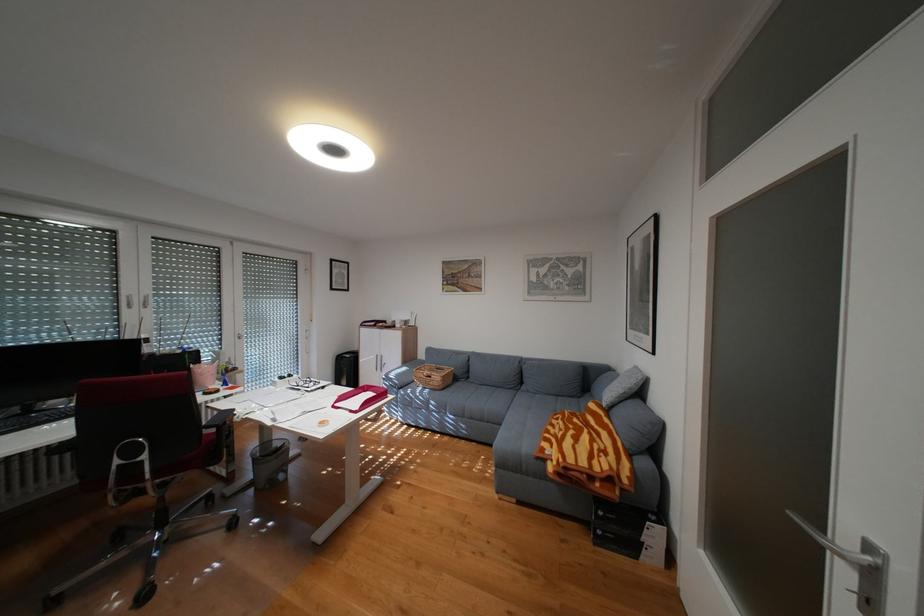
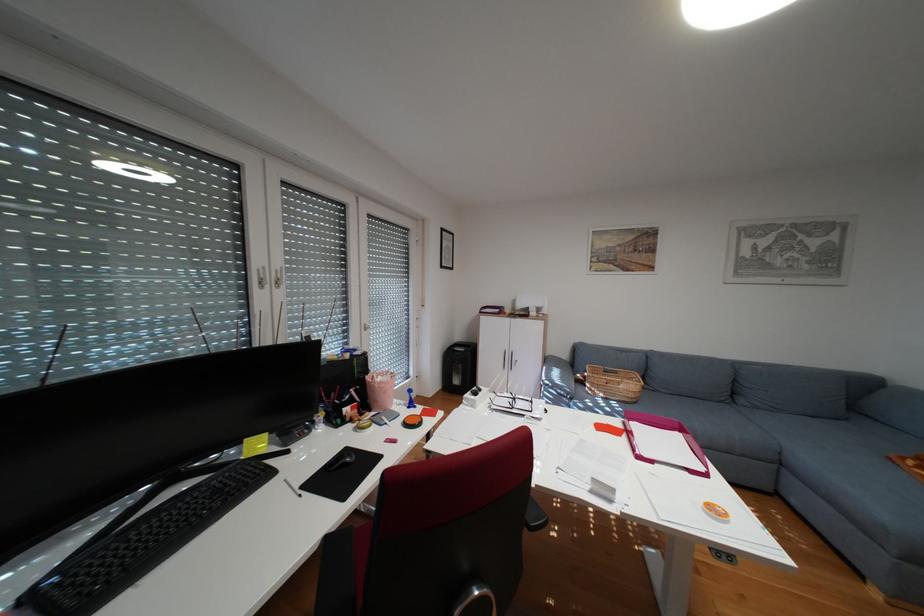
What movement of the cameraman would produce the second image?

The cameraman walked toward left, forward.